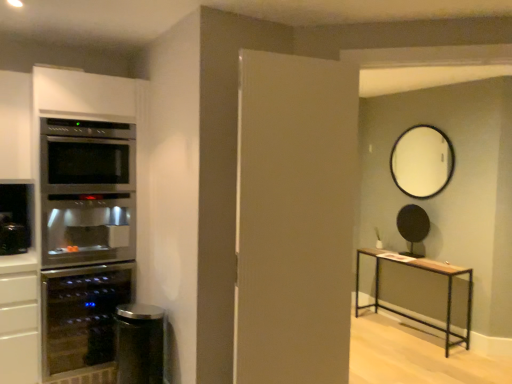
Question: Should I look upward or downward to see black matte round mirror at upper center, which appears as the third appliance when viewed from the left?

Choices:
 (A) down
 (B) up

Answer: (A)

Question: Can you confirm if white glossy mirror at upper center is wider than light brown wood table at right?

Choices:
 (A) yes
 (B) no

Answer: (B)

Question: Is white glossy mirror at upper center positioned with its back to light brown wood table at right?

Choices:
 (A) no
 (B) yes

Answer: (A)

Question: Is white glossy mirror at upper center oriented towards light brown wood table at right?

Choices:
 (A) no
 (B) yes

Answer: (A)

Question: From the image's perspective, is white glossy mirror at upper center over light brown wood table at right?

Choices:
 (A) no
 (B) yes

Answer: (B)

Question: Is white glossy mirror at upper center far from light brown wood table at right?

Choices:
 (A) yes
 (B) no

Answer: (B)

Question: Is white glossy mirror at upper center in contact with light brown wood table at right?

Choices:
 (A) yes
 (B) no

Answer: (B)

Question: Considering the relative sizes of black matte round mirror at upper center, which appears as the third appliance when viewed from the left, and white matte door at center in the image provided, is black matte round mirror at upper center, which appears as the third appliance when viewed from the left, wider than white matte door at center?

Choices:
 (A) yes
 (B) no

Answer: (A)

Question: Can you confirm if black matte round mirror at upper center, placed as the first appliance when sorted from right to left, is positioned to the right of white matte door at center?

Choices:
 (A) yes
 (B) no

Answer: (A)

Question: Is white matte door at center completely or partially inside black matte round mirror at upper center, which appears as the third appliance when viewed from the left?

Choices:
 (A) yes
 (B) no

Answer: (B)

Question: Is black matte round mirror at upper center, which is the 1th appliance in back-to-front order, at the left side of white matte door at center?

Choices:
 (A) no
 (B) yes

Answer: (A)

Question: Is black matte round mirror at upper center, placed as the first appliance when sorted from right to left, positioned beyond the bounds of white matte door at center?

Choices:
 (A) yes
 (B) no

Answer: (A)

Question: Is black matte round mirror at upper center, which appears as the third appliance when viewed from the left, next to white matte door at center?

Choices:
 (A) yes
 (B) no

Answer: (B)

Question: Can we say black matte round mirror at upper center, which appears as the third appliance when viewed from the left, lies outside matte glass wine cooler at left, the second appliance from the front?

Choices:
 (A) no
 (B) yes

Answer: (B)